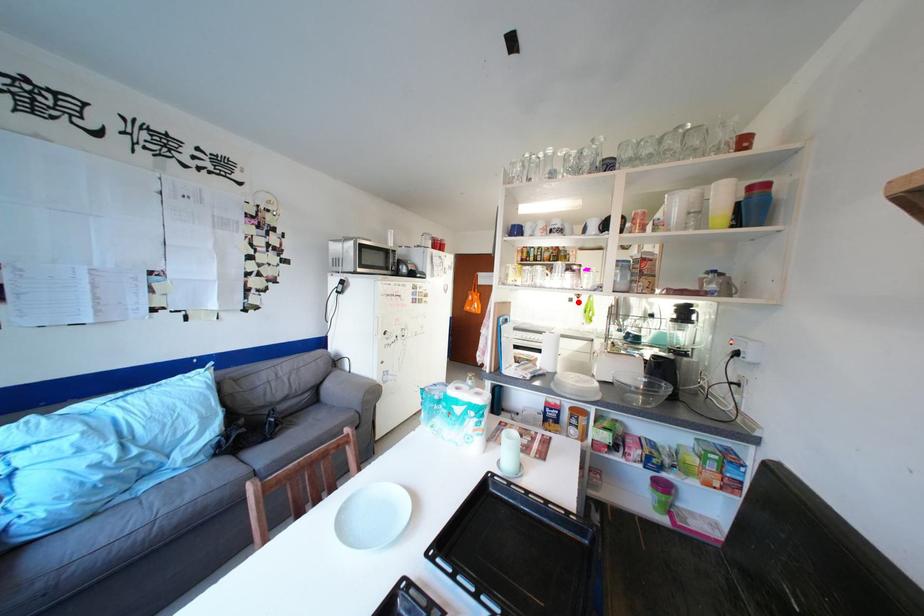
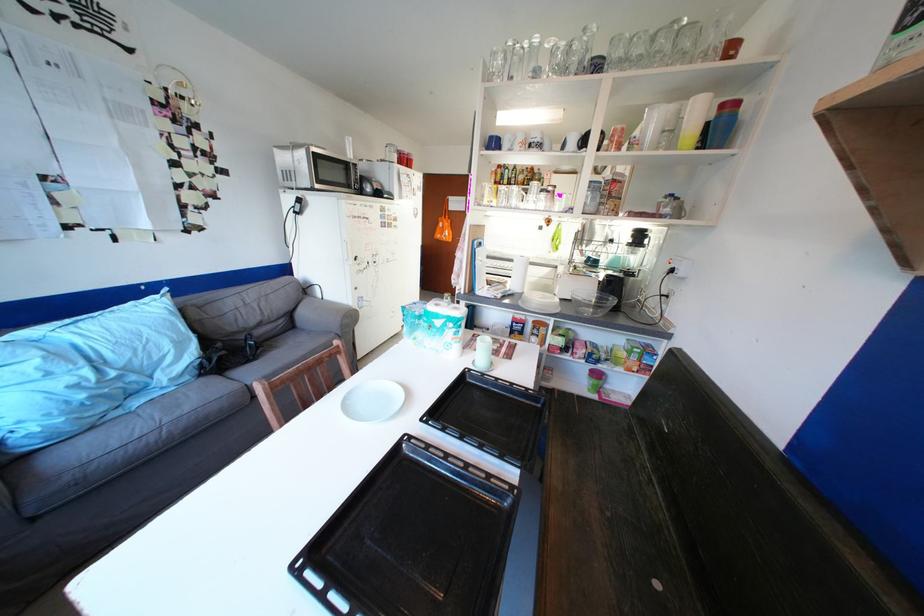
The point at the highlighted location is marked in the first image. Where is the corresponding point in the second image?

(548, 230)